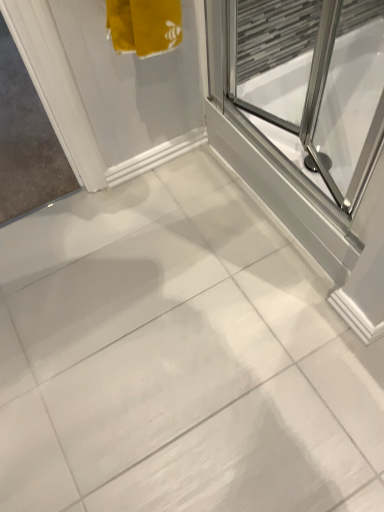
Question: Can you confirm if white plastic door at left is smaller than transparent glass shower door at upper right?

Choices:
 (A) no
 (B) yes

Answer: (B)

Question: Can you confirm if white plastic door at left is taller than transparent glass shower door at upper right?

Choices:
 (A) yes
 (B) no

Answer: (B)

Question: Does white plastic door at left appear on the left side of transparent glass shower door at upper right?

Choices:
 (A) no
 (B) yes

Answer: (B)

Question: Is white plastic door at left oriented towards transparent glass shower door at upper right?

Choices:
 (A) yes
 (B) no

Answer: (B)

Question: Does white plastic door at left come behind transparent glass shower door at upper right?

Choices:
 (A) yes
 (B) no

Answer: (A)

Question: Considering the relative sizes of white plastic door at left and transparent glass shower door at upper right in the image provided, is white plastic door at left bigger than transparent glass shower door at upper right?

Choices:
 (A) no
 (B) yes

Answer: (A)

Question: Is transparent glass shower door at upper right placed right next to white plastic door at left?

Choices:
 (A) yes
 (B) no

Answer: (B)

Question: Considering the relative sizes of transparent glass shower door at upper right and white plastic door at left in the image provided, is transparent glass shower door at upper right smaller than white plastic door at left?

Choices:
 (A) yes
 (B) no

Answer: (B)

Question: Is transparent glass shower door at upper right wider than white plastic door at left?

Choices:
 (A) yes
 (B) no

Answer: (B)

Question: From the image's perspective, is transparent glass shower door at upper right on white plastic door at left?

Choices:
 (A) no
 (B) yes

Answer: (A)

Question: From a real-world perspective, is transparent glass shower door at upper right physically above white plastic door at left?

Choices:
 (A) yes
 (B) no

Answer: (A)

Question: Is the depth of transparent glass shower door at upper right less than that of white plastic door at left?

Choices:
 (A) no
 (B) yes

Answer: (B)

Question: In terms of width, does white plastic door at left look wider or thinner when compared to transparent glass shower door at upper right?

Choices:
 (A) thin
 (B) wide

Answer: (B)